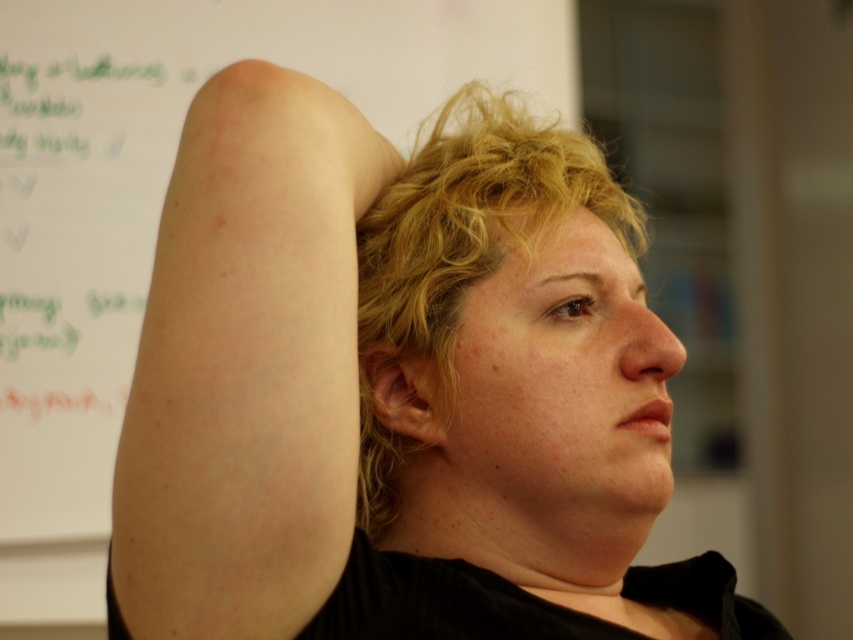
Is pale skin arm at upper left bigger than white paper at upper left?

No.

Consider the image. Does pale skin arm at upper left have a greater height compared to white paper at upper left?

Incorrect, pale skin arm at upper left's height is not larger of white paper at upper left's.

I want to click on pale skin arm at upper left, so click(398, 388).

Identify the location of pale skin arm at upper left. point(398,388).

Does pale skin arm at upper left lie in front of pale skin at upper right?

Yes, it is in front of pale skin at upper right.

Can you confirm if pale skin arm at upper left is wider than pale skin at upper right?

Yes.

Who is more distant from viewer, (300, 412) or (308, 196)?

The point (308, 196) is more distant.

Image resolution: width=853 pixels, height=640 pixels. I want to click on pale skin arm at upper left, so click(x=398, y=388).

Between white paper at upper left and blonde curly hair at center, which one has more height?

white paper at upper left

Is white paper at upper left above blonde curly hair at center?

Yes, white paper at upper left is above blonde curly hair at center.

Does point (54, 70) come in front of point (447, 170)?

No, it is behind (447, 170).

Locate an element on the screen. The image size is (853, 640). white paper at upper left is located at coordinates (167, 177).